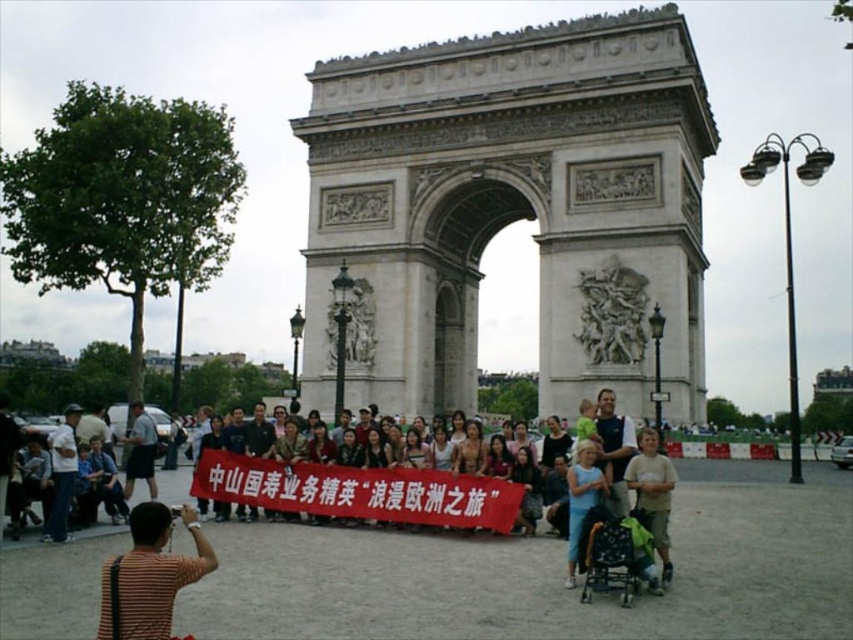
Question: Considering the real-world distances, which object is farthest from the light brown fabric shirt at lower right?

Choices:
 (A) dark blue fabric baby carriage at lower center
 (B) matte brown banner at center

Answer: (B)

Question: Observing the image, what is the correct spatial positioning of dark blue fabric baby carriage at lower center in reference to light brown fabric shirt at lower right?

Choices:
 (A) left
 (B) right

Answer: (A)

Question: Is dark blue fabric baby carriage at lower center positioned in front of light brown fabric shirt at lower right?

Choices:
 (A) no
 (B) yes

Answer: (B)

Question: Does dark blue fabric baby carriage at lower center appear on the right side of light brown fabric shirt at lower right?

Choices:
 (A) no
 (B) yes

Answer: (A)

Question: Among these points, which one is nearest to the camera?

Choices:
 (A) (670, 504)
 (B) (639, 547)
 (C) (485, 515)

Answer: (B)

Question: Estimate the real-world distances between objects in this image. Which object is farther from the dark blue fabric baby carriage at lower center?

Choices:
 (A) light brown fabric shirt at lower right
 (B) matte brown banner at center

Answer: (B)